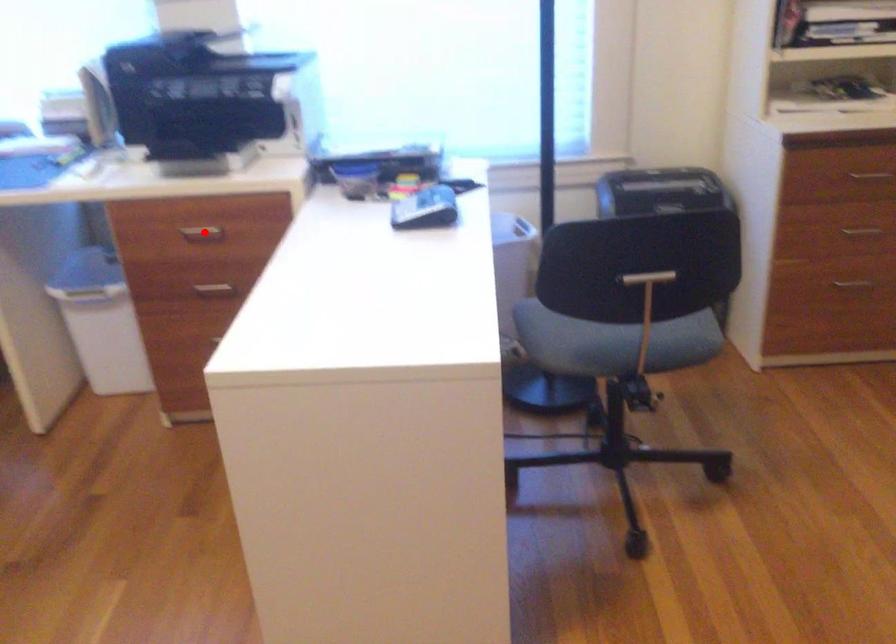
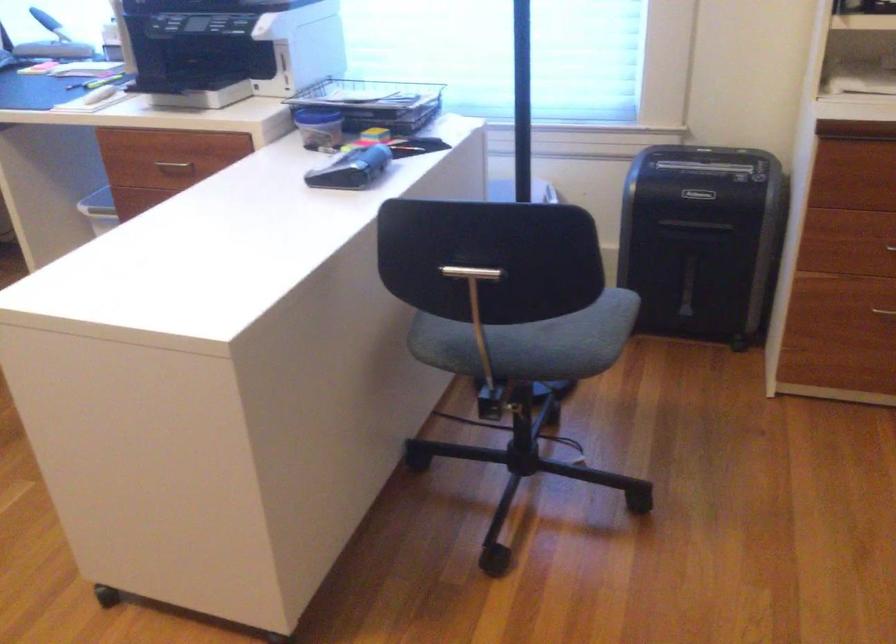
Find the pixel in the second image that matches the highlighted location in the first image.

(174, 165)